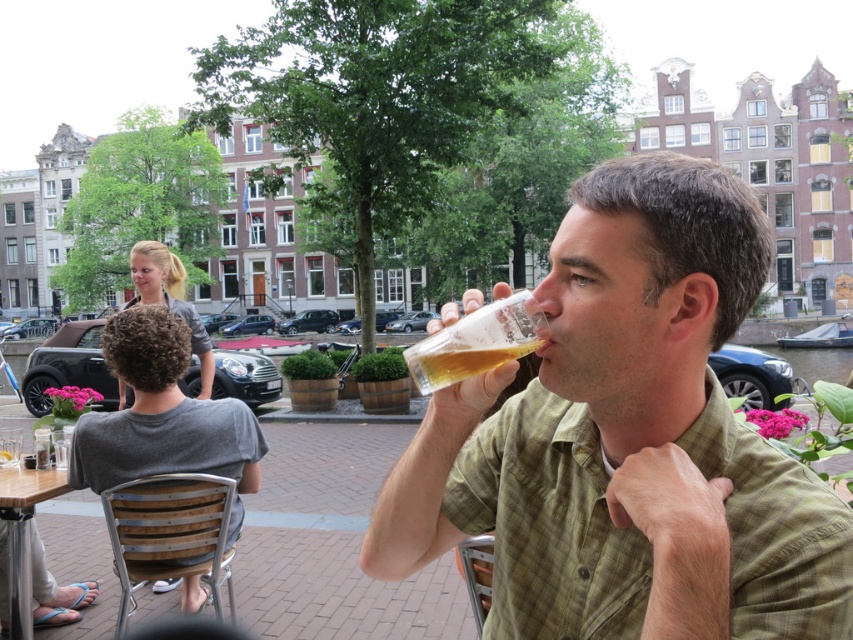
You are standing at the point marked by the coordinates point (x=628, y=440). What object is located at this point?

The point (x=628, y=440) marks the location of the matte green shirt at center.

You are a photographer taking a picture of the matte green shirt at center and the gray cotton shirt at upper left. Which shirt should you focus on first if you want to capture both in the same frame, considering their sizes?

The matte green shirt at center is taller than the gray cotton shirt at upper left, so you should focus on the matte green shirt at center first to ensure it fits properly in the frame.